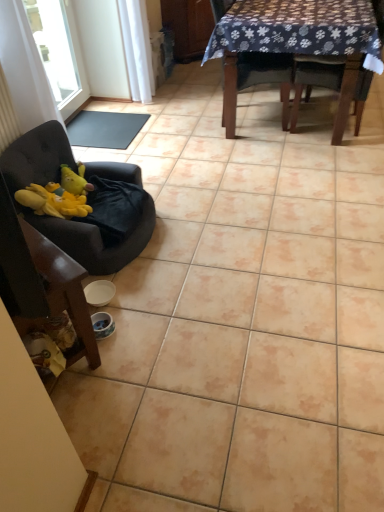
Locate an element on the screen. The image size is (384, 512). vacant area that is in front of wooden table at upper center is located at coordinates (276, 205).